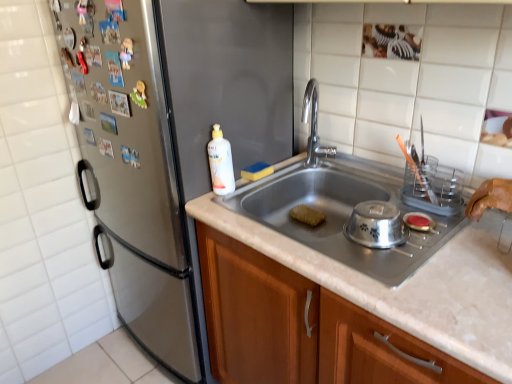
Where is `free space in front of silver metallic bowl at sink`? Image resolution: width=512 pixels, height=384 pixels. free space in front of silver metallic bowl at sink is located at coordinates (400, 276).